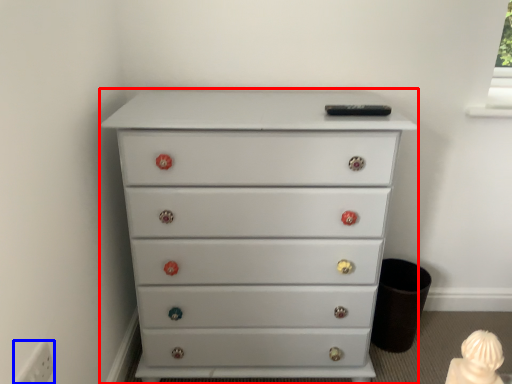
Question: Among these objects, which one is nearest to the camera, chest of drawers (highlighted by a red box) or electric outlet (highlighted by a blue box)?

Choices:
 (A) chest of drawers
 (B) electric outlet

Answer: (B)